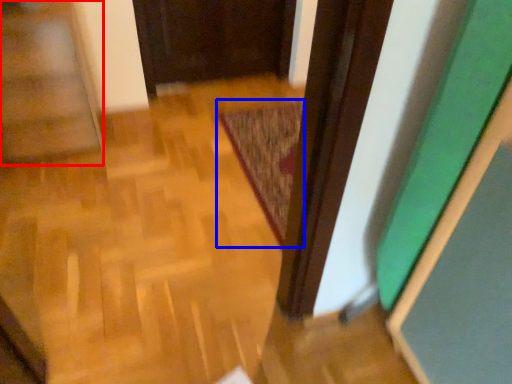
Question: Which object appears farthest to the camera in this image, stairwell (highlighted by a red box) or mat (highlighted by a blue box)?

Choices:
 (A) stairwell
 (B) mat

Answer: (B)